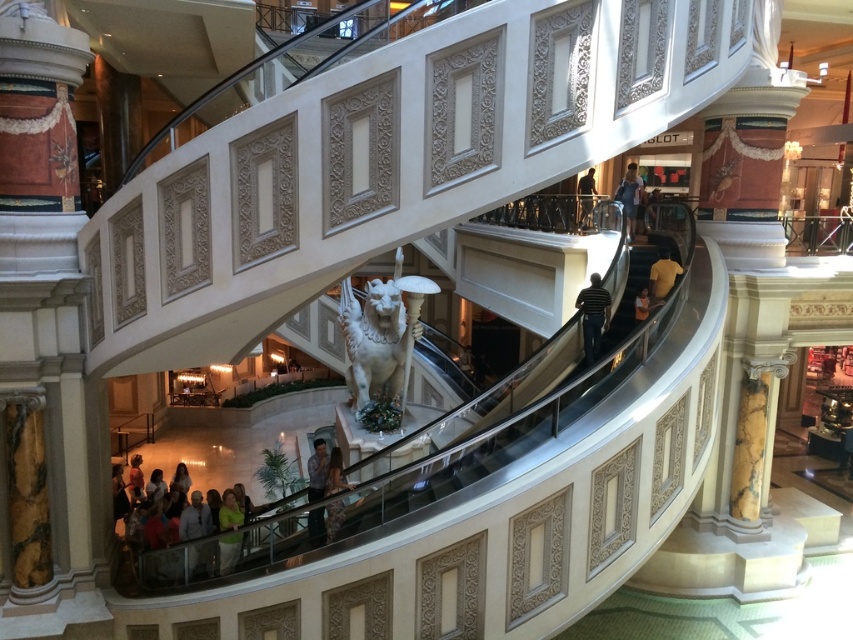
Question: Which object is closer to the camera taking this photo?

Choices:
 (A) orange fabric shirt at upper right
 (B) light green fabric at lower center
 (C) green matte shirt at lower center
 (D) matte black dress at lower center

Answer: (D)

Question: Considering the relative positions of light green fabric at lower center and matte black dress at lower center in the image provided, where is light green fabric at lower center located with respect to matte black dress at lower center?

Choices:
 (A) left
 (B) right

Answer: (A)

Question: Does white marble statue at center appear on the left side of blue denim jeans at upper right?

Choices:
 (A) yes
 (B) no

Answer: (A)

Question: Which point is farther to the camera?

Choices:
 (A) (583, 227)
 (B) (642, 298)

Answer: (A)

Question: Which point is farther to the camera?

Choices:
 (A) dark blue jeans at upper center
 (B) green matte shirt at lower center
 (C) yellow cotton shirt at upper right

Answer: (A)

Question: Can you confirm if green matte shirt at lower center is wider than matte black dress at lower center?

Choices:
 (A) yes
 (B) no

Answer: (A)